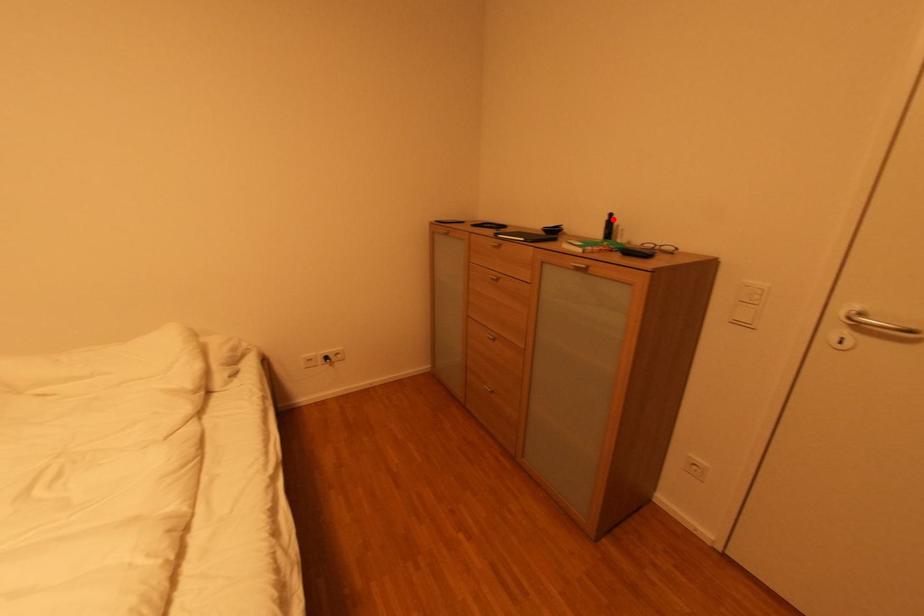
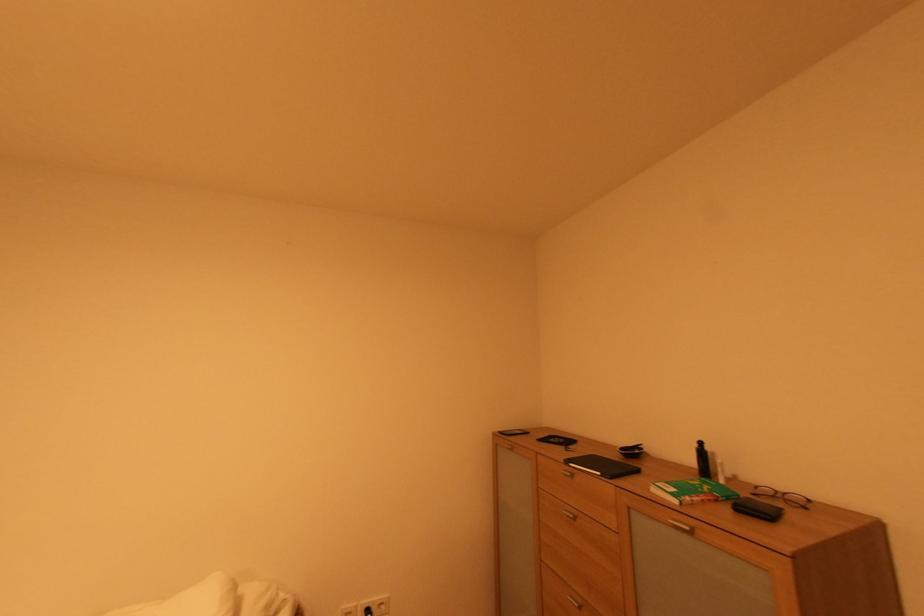
Locate, in the second image, the point that corresponds to the highlighted location in the first image.

(701, 447)